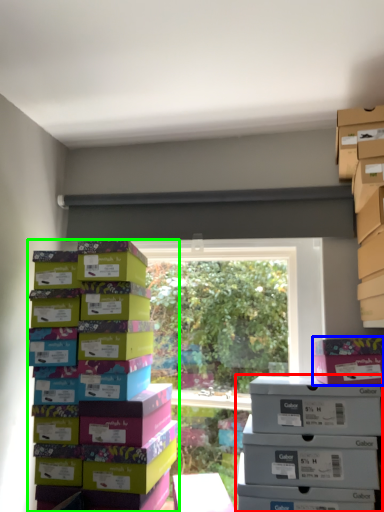
Question: Based on their relative distances, which object is nearer to storage box (highlighted by a red box)? Choose from cardboard box (highlighted by a blue box) and box (highlighted by a green box).

Choices:
 (A) cardboard box
 (B) box

Answer: (A)